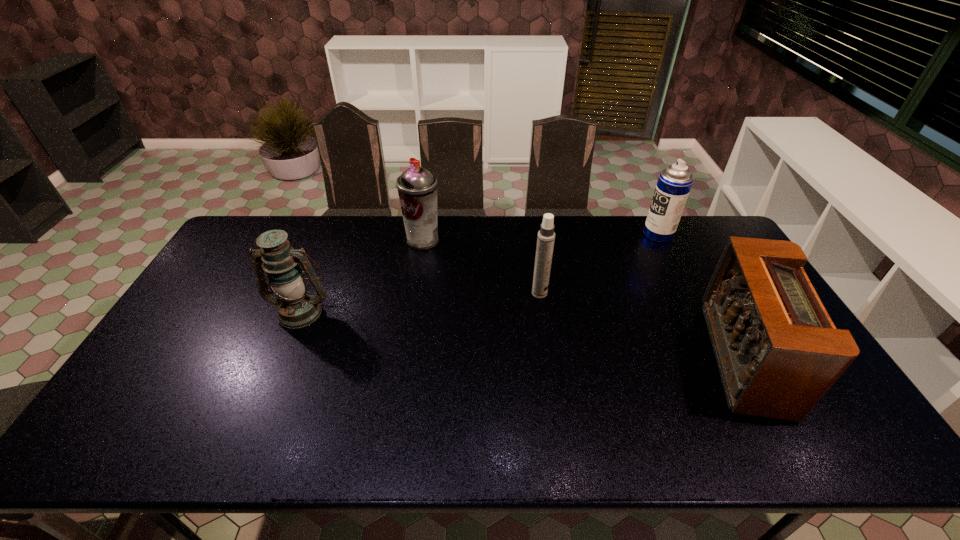
Find the location of a particular element. Image resolution: width=960 pixels, height=540 pixels. the second object from left to right is located at coordinates (417, 187).

Identify the location of the rightmost aerosol can. The width and height of the screenshot is (960, 540). 674,183.

You are a GUI agent. You are given a task and a screenshot of the screen. Output one action in this format:
    pyautogui.click(x=<x>, y=<y>)
    Task: Click on the leftmost object
    
    Given the screenshot: What is the action you would take?
    pyautogui.click(x=297, y=307)

This screenshot has width=960, height=540. Find the location of `the nearest aerosol can`. the nearest aerosol can is located at coordinates (546, 236).

Identify the location of the third object from left to right. This screenshot has height=540, width=960. (546, 236).

I want to click on radio receiver, so point(778,352).

The width and height of the screenshot is (960, 540). In order to click on vacant position located on the right of the second object from left to right in this screenshot , I will do `click(512, 240)`.

I want to click on vacant space positioned 0.050m on the label side of the rightmost aerosol can, so click(630, 234).

Locate an element on the screen. The width and height of the screenshot is (960, 540). vacant position located on the label side of the rightmost aerosol can is located at coordinates (588, 234).

Find the location of a particular element. vacant space located on the label side of the rightmost aerosol can is located at coordinates (539, 234).